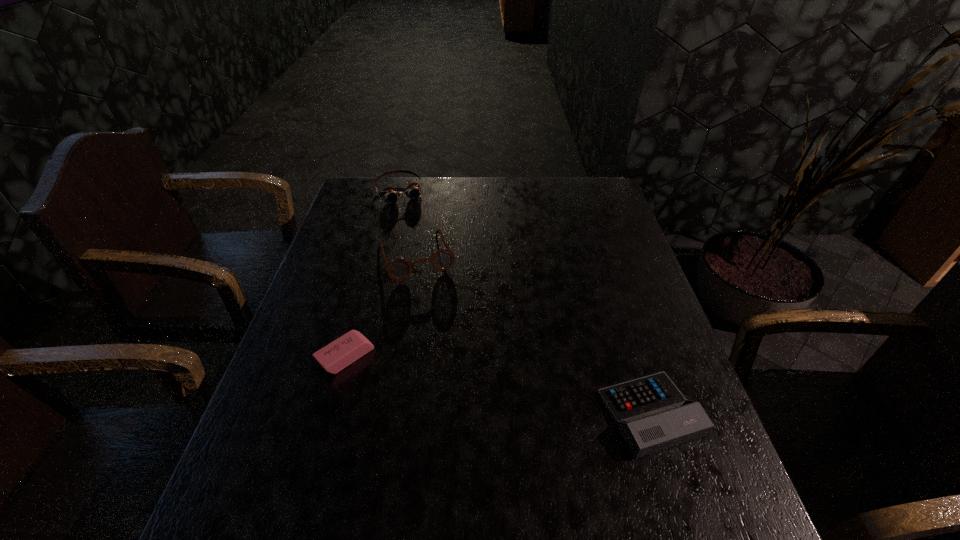
This screenshot has height=540, width=960. What are the coordinates of `empty space between the eraser and the rightmost object` in the screenshot? It's located at (498, 385).

Image resolution: width=960 pixels, height=540 pixels. Identify the location of vacant area that lies between the third nearest object and the calculator. (533, 335).

The width and height of the screenshot is (960, 540). Identify the location of free space between the third shortest object and the eraser. (372, 274).

The height and width of the screenshot is (540, 960). I want to click on free spot between the tallest object and the goggles, so click(407, 224).

This screenshot has width=960, height=540. Find the location of `empty location between the second farthest object and the rightmost object`. empty location between the second farthest object and the rightmost object is located at coordinates [x=533, y=335].

You are a GUI agent. You are given a task and a screenshot of the screen. Output one action in this format:
    pyautogui.click(x=<x>, y=<y>)
    Task: Click on the vacant space that's between the spectacles and the eraser
    Image resolution: width=960 pixels, height=540 pixels.
    Given the screenshot: What is the action you would take?
    pyautogui.click(x=380, y=307)

Identify the location of vacant area that lies between the eraser and the tallest object. (380, 307).

Locate an element on the screen. The height and width of the screenshot is (540, 960). vacant region between the calculator and the eraser is located at coordinates (498, 385).

Locate an element on the screen. The width and height of the screenshot is (960, 540). object that is the closest to the rightmost object is located at coordinates (398, 269).

Select which object is the closest to the second tallest object. Please provide its 2D coordinates. Your answer should be formatted as a tuple, i.e. [(x, y)], where the tuple contains the x and y coordinates of a point satisfying the conditions above.

[(398, 269)]